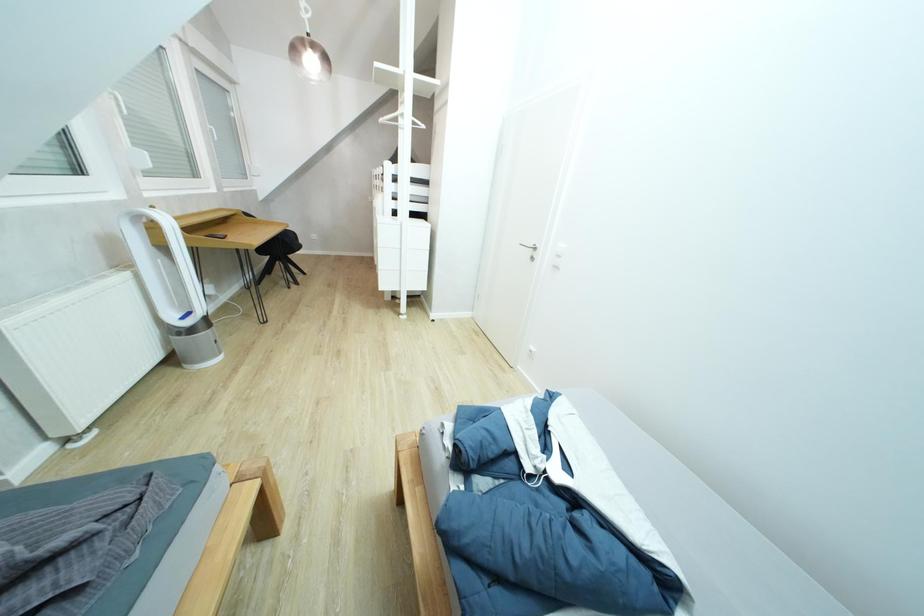
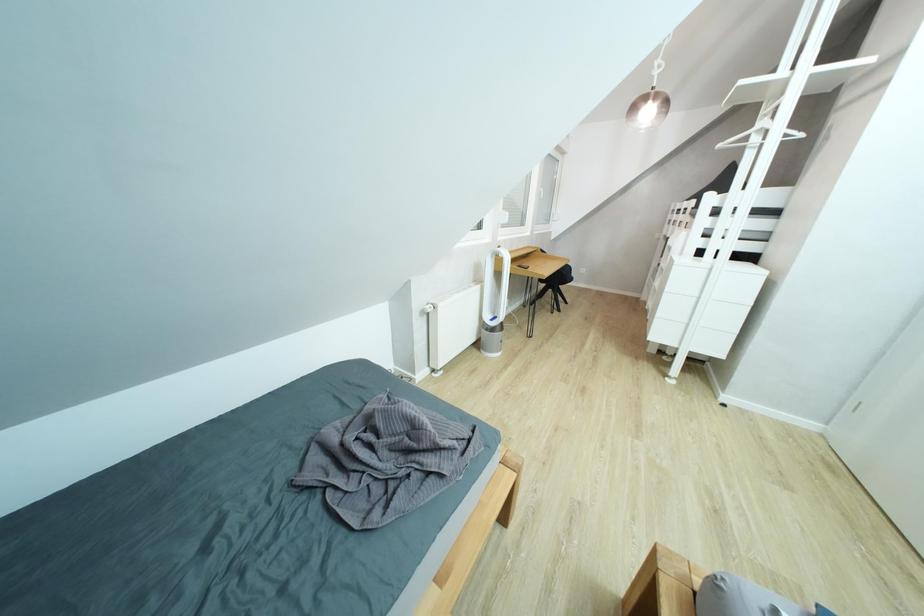
Question: Based on the continuous images, in which direction is the camera rotating? Reply with the corresponding letter.

Choices:
 (A) Left
 (B) Right
 (C) Up
 (D) Down

Answer: (A)